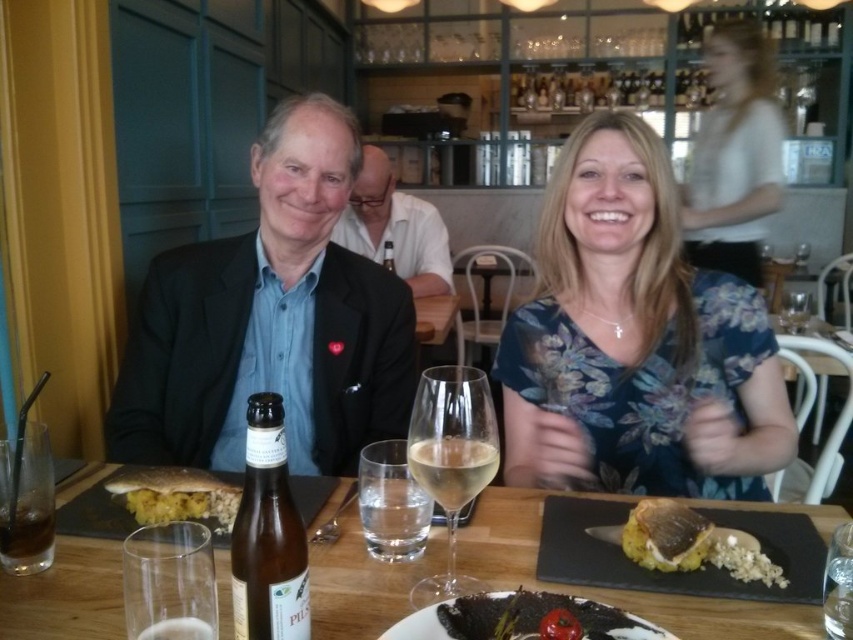
Question: Does wooden table at center appear over clear glass wine glass at center?

Choices:
 (A) yes
 (B) no

Answer: (B)

Question: Which of the following is the farthest from the observer?

Choices:
 (A) (666, 515)
 (B) (161, 579)
 (C) (132, 513)
 (D) (299, 627)

Answer: (C)

Question: Which point is farther from the camera taking this photo?

Choices:
 (A) (451, 516)
 (B) (549, 608)

Answer: (A)

Question: Which point is farther to the camera?

Choices:
 (A) wooden table at center
 (B) clear glass wine at lower left

Answer: (A)

Question: Is floral print blouse at center above translucent glass bottle at center?

Choices:
 (A) no
 (B) yes

Answer: (B)

Question: Does translucent glass bottle at center appear under brown glass bottle at center?

Choices:
 (A) no
 (B) yes

Answer: (B)